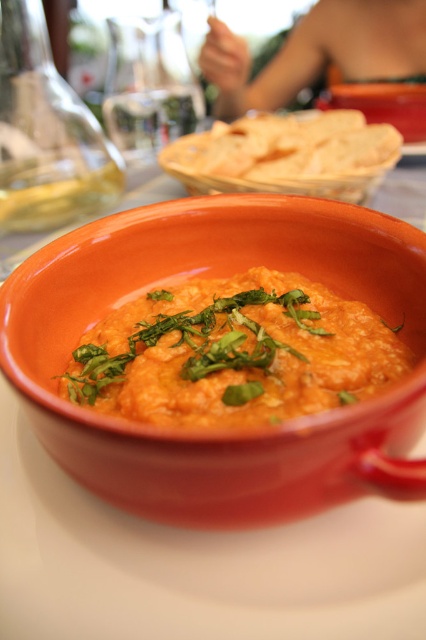
Question: Which point is farther to the camera?

Choices:
 (A) (389, 449)
 (B) (146, 372)

Answer: (B)

Question: Is matte ceramic bowl at center thinner than matte orange dip at center?

Choices:
 (A) yes
 (B) no

Answer: (B)

Question: Does matte ceramic bowl at center come in front of matte orange dip at center?

Choices:
 (A) yes
 (B) no

Answer: (A)

Question: Which point appears farthest from the camera in this image?

Choices:
 (A) (207, 352)
 (B) (34, 417)

Answer: (A)

Question: Is matte ceramic bowl at center thinner than matte orange dip at center?

Choices:
 (A) yes
 (B) no

Answer: (B)

Question: Which point is farther to the camera?

Choices:
 (A) matte orange dip at center
 (B) matte ceramic bowl at center

Answer: (A)